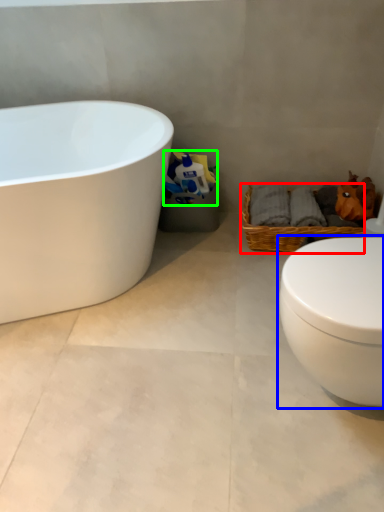
Question: Which is farther away from picnic basket (highlighted by a red box)? toilet (highlighted by a blue box) or toilet paper (highlighted by a green box)?

Choices:
 (A) toilet
 (B) toilet paper

Answer: (A)